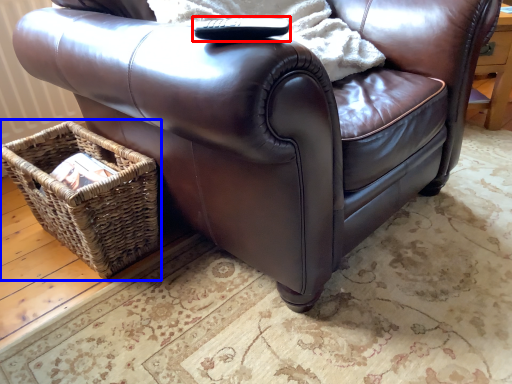
Question: Which object is further to the camera taking this photo, remote (highlighted by a red box) or picnic basket (highlighted by a blue box)?

Choices:
 (A) remote
 (B) picnic basket

Answer: (B)